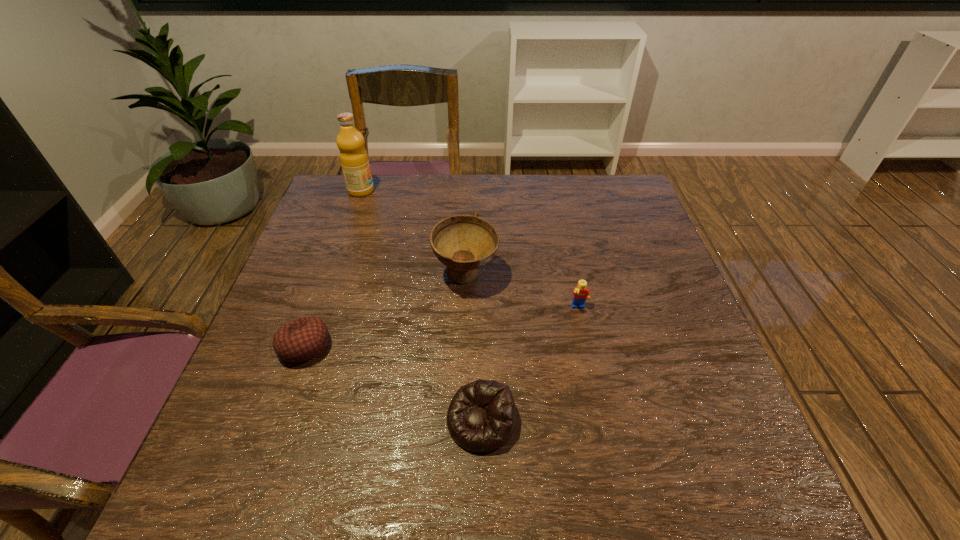
In order to click on the tallest object in this screenshot , I will do `click(354, 160)`.

You are a GUI agent. You are given a task and a screenshot of the screen. Output one action in this format:
    pyautogui.click(x=<x>, y=<y>)
    Task: Click on the farthest object
    The width and height of the screenshot is (960, 540).
    Given the screenshot: What is the action you would take?
    pyautogui.click(x=354, y=160)

In order to click on the fourth shortest object in this screenshot , I will do `click(464, 243)`.

The image size is (960, 540). What are the coordinates of `soup bowl` in the screenshot? It's located at (464, 243).

Locate an element on the screen. the third tallest object is located at coordinates (580, 294).

Where is `the rightmost object`? Image resolution: width=960 pixels, height=540 pixels. the rightmost object is located at coordinates tap(580, 294).

Image resolution: width=960 pixels, height=540 pixels. I want to click on the farther beanbag, so click(303, 339).

Locate an element on the screen. Image resolution: width=960 pixels, height=540 pixels. the left beanbag is located at coordinates (303, 339).

Image resolution: width=960 pixels, height=540 pixels. I want to click on the right beanbag, so 481,417.

I want to click on the nearest object, so click(481, 417).